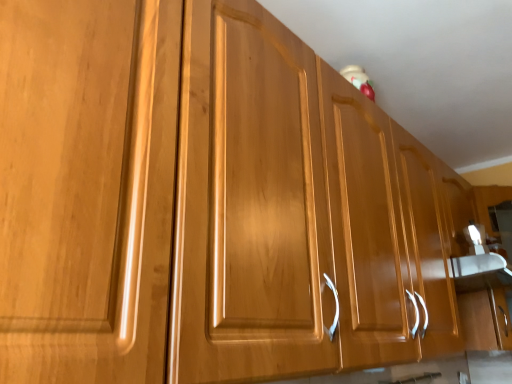
The image size is (512, 384). Describe the element at coordinates (476, 238) in the screenshot. I see `white glossy faucet at lower right` at that location.

Find the location of `white glossy faucet at lower right`. white glossy faucet at lower right is located at coordinates (476, 238).

You are a GUI agent. You are given a task and a screenshot of the screen. Output one action in this format:
    pyautogui.click(x=<x>, y=<y>)
    Task: Click on the white glossy faucet at lower right
    The width and height of the screenshot is (512, 384).
    Given the screenshot: What is the action you would take?
    pyautogui.click(x=476, y=238)